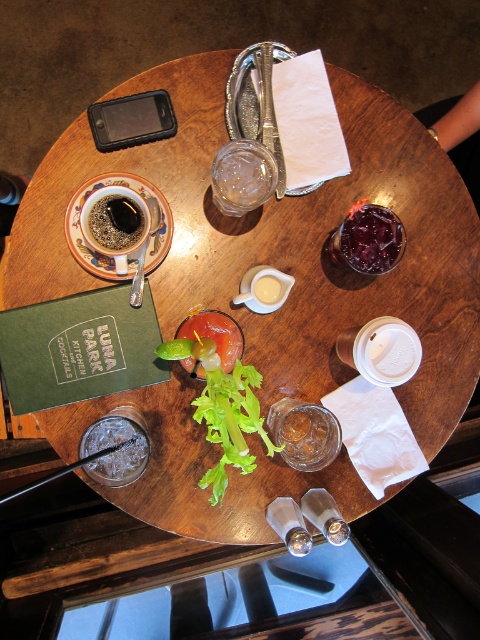
Does matte ceramic cup at upper left appear on the right side of translucent glass with garnish at center?

In fact, matte ceramic cup at upper left is to the left of translucent glass with garnish at center.

Does matte ceramic cup at upper left have a lesser width compared to translucent glass with garnish at center?

No, matte ceramic cup at upper left is not thinner than translucent glass with garnish at center.

Describe the element at coordinates (115, 227) in the screenshot. I see `matte ceramic cup at upper left` at that location.

At what (x,y) coordinates should I click in order to perform the action: click on matte ceramic cup at upper left. Please return your answer as a coordinate pair (x, y). The height and width of the screenshot is (640, 480). Looking at the image, I should click on (115, 227).

Describe the element at coordinates (268, 109) in the screenshot. I see `metallic silverware at center` at that location.

Does metallic silverware at center have a greater height compared to matte black coffee cup at upper left?

Correct, metallic silverware at center is much taller as matte black coffee cup at upper left.

The image size is (480, 640). I want to click on metallic silverware at center, so click(x=268, y=109).

At what (x,y) coordinates should I click in order to perform the action: click on metallic silverware at center. Please return your answer as a coordinate pair (x, y). Looking at the image, I should click on (268, 109).

Who is higher up, matte ceramic cup at upper left or matte black coffee cup at upper left?

Positioned higher is matte black coffee cup at upper left.

Which is behind, point (159, 237) or point (95, 234)?

Positioned behind is point (159, 237).

Describe the element at coordinates (115, 227) in the screenshot. I see `matte ceramic cup at upper left` at that location.

Where is `matte ceramic cup at upper left`? The width and height of the screenshot is (480, 640). matte ceramic cup at upper left is located at coordinates (115, 227).